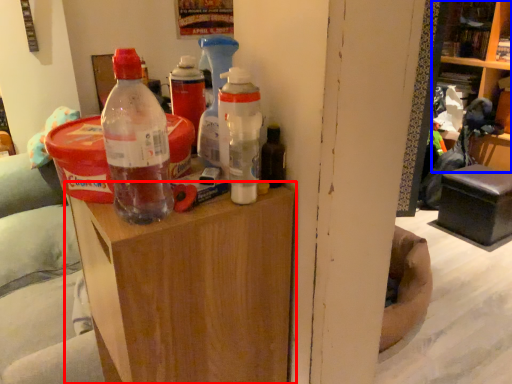
Question: Which object appears farthest to the camera in this image, furniture (highlighted by a red box) or shelf (highlighted by a blue box)?

Choices:
 (A) furniture
 (B) shelf

Answer: (B)